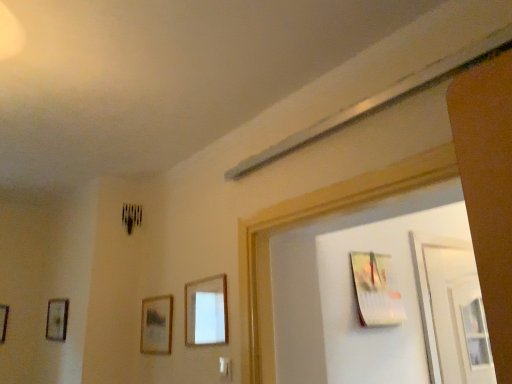
In the scene shown: Measure the distance between wooden picture frame at lower center, arranged as the 3th picture frame when viewed from the right, and camera.

A distance of 2.01 meters exists between wooden picture frame at lower center, arranged as the 3th picture frame when viewed from the right, and camera.

In order to face wooden picture frame at left, which is counted as the fourth picture frame, starting from the right, should I rotate leftwards or rightwards?

You should look left and rotate roughly 24.868 degrees.

Describe the element at coordinates (57, 319) in the screenshot. Image resolution: width=512 pixels, height=384 pixels. I see `wooden picture frame at left, the 2th picture frame positioned from the left` at that location.

The height and width of the screenshot is (384, 512). Find the location of `wooden picture frame at left, the fifth picture frame viewed from the right`. wooden picture frame at left, the fifth picture frame viewed from the right is located at coordinates (3, 321).

Could you tell me if wooden picture frame at center, acting as the 2th picture frame starting from the right, is turned towards metallic silver picture frame at upper right, the 5th picture frame when ordered from left to right?

No, wooden picture frame at center, acting as the 2th picture frame starting from the right, is not oriented towards metallic silver picture frame at upper right, the 5th picture frame when ordered from left to right.

Based on the photo, are wooden picture frame at center, positioned as the fourth picture frame in left-to-right order, and metallic silver picture frame at upper right, the 5th picture frame when ordered from left to right, making contact?

No, wooden picture frame at center, positioned as the fourth picture frame in left-to-right order, is not making contact with metallic silver picture frame at upper right, the 5th picture frame when ordered from left to right.

Which of these two, wooden picture frame at center, acting as the 2th picture frame starting from the right, or metallic silver picture frame at upper right, the 5th picture frame when ordered from left to right, is bigger?

Bigger between the two is metallic silver picture frame at upper right, the 5th picture frame when ordered from left to right.

Who is shorter, wooden picture frame at center, positioned as the fourth picture frame in left-to-right order, or metallic silver picture frame at upper right, the 5th picture frame when ordered from left to right?

With less height is wooden picture frame at center, positioned as the fourth picture frame in left-to-right order.

From the image's perspective, count 3rd picture frames upward from the wooden picture frame at left, which is counted as the fourth picture frame, starting from the right, and point to it. Please provide its 2D coordinates.

[(376, 290)]

Which object is further away from the camera taking this photo, metallic silver picture frame at upper right, the 1th picture frame when ordered from right to left, or wooden picture frame at left, which is counted as the fourth picture frame, starting from the right?

wooden picture frame at left, which is counted as the fourth picture frame, starting from the right, is further from the camera.

Is point (381, 279) closer or farther from the camera than point (53, 314)?

Point (381, 279).

Which of these two, metallic silver picture frame at upper right, the 1th picture frame when ordered from right to left, or wooden picture frame at left, which is counted as the fourth picture frame, starting from the right, is thinner?

With smaller width is wooden picture frame at left, which is counted as the fourth picture frame, starting from the right.

From a real-world perspective, is wooden picture frame at center, positioned as the fourth picture frame in left-to-right order, positioned over wooden picture frame at left, the 2th picture frame positioned from the left, based on gravity?

Actually, wooden picture frame at center, positioned as the fourth picture frame in left-to-right order, is physically below wooden picture frame at left, the 2th picture frame positioned from the left, in the real world.

Between point (217, 338) and point (58, 310), which one is positioned in front?

The point (217, 338) is more forward.

Can you confirm if wooden picture frame at center, positioned as the fourth picture frame in left-to-right order, is shorter than wooden picture frame at left, which is counted as the fourth picture frame, starting from the right?

Incorrect, the height of wooden picture frame at center, positioned as the fourth picture frame in left-to-right order, does not fall short of that of wooden picture frame at left, which is counted as the fourth picture frame, starting from the right.

Find the location of a particular element. the 2nd picture frame counting from the left side of the wooden picture frame at center, acting as the 2th picture frame starting from the right is located at coordinates (57, 319).

Which object is closer to the camera, wooden picture frame at left, which is counted as the fourth picture frame, starting from the right, or wooden picture frame at lower center, arranged as the third picture frame when viewed from the left?

wooden picture frame at lower center, arranged as the third picture frame when viewed from the left, is closer to the camera.

Which is behind, point (56, 310) or point (167, 334)?

The point (56, 310) is farther.

Based on the photo, from a real-world perspective, between wooden picture frame at left, which is counted as the fourth picture frame, starting from the right, and wooden picture frame at lower center, arranged as the 3th picture frame when viewed from the right, who is vertically higher?

In real-world perspective, wooden picture frame at left, which is counted as the fourth picture frame, starting from the right, is above.

Which is more to the left, wooden picture frame at left, the 2th picture frame positioned from the left, or wooden picture frame at lower center, arranged as the 3th picture frame when viewed from the right?

wooden picture frame at left, the 2th picture frame positioned from the left.

From a real-world perspective, is wooden picture frame at lower center, arranged as the third picture frame when viewed from the left, under metallic silver picture frame at upper right, the 5th picture frame when ordered from left to right?

Yes.

Which is more to the left, wooden picture frame at lower center, arranged as the third picture frame when viewed from the left, or metallic silver picture frame at upper right, the 1th picture frame when ordered from right to left?

wooden picture frame at lower center, arranged as the third picture frame when viewed from the left, is more to the left.

Would you say metallic silver picture frame at upper right, the 5th picture frame when ordered from left to right, is part of wooden picture frame at lower center, arranged as the third picture frame when viewed from the left,'s contents?

No, metallic silver picture frame at upper right, the 5th picture frame when ordered from left to right, is not a part of wooden picture frame at lower center, arranged as the third picture frame when viewed from the left.

Are wooden picture frame at lower center, arranged as the third picture frame when viewed from the left, and metallic silver picture frame at upper right, the 5th picture frame when ordered from left to right, located far from each other?

No, wooden picture frame at lower center, arranged as the third picture frame when viewed from the left, is not far from metallic silver picture frame at upper right, the 5th picture frame when ordered from left to right.

From a real-world perspective, who is located higher, wooden picture frame at left, which ranks as the 1th picture frame in left-to-right order, or wooden picture frame at left, which is counted as the fourth picture frame, starting from the right?

From a 3D spatial view, wooden picture frame at left, which is counted as the fourth picture frame, starting from the right, is above.

Looking at this image, would you say wooden picture frame at left, which is counted as the fourth picture frame, starting from the right, is part of wooden picture frame at left, the fifth picture frame viewed from the right,'s contents?

No, wooden picture frame at left, which is counted as the fourth picture frame, starting from the right, is not a part of wooden picture frame at left, the fifth picture frame viewed from the right.

At what (x,y) coordinates should I click in order to perform the action: click on picture frame behind the wooden picture frame at left, which is counted as the fourth picture frame, starting from the right. Please return your answer as a coordinate pair (x, y). This screenshot has width=512, height=384. Looking at the image, I should click on (3, 321).

How different are the orientations of wooden picture frame at left, the fifth picture frame viewed from the right, and wooden picture frame at left, the 2th picture frame positioned from the left, in degrees?

87.3 degrees.

How much distance is there between metallic silver picture frame at upper right, the 5th picture frame when ordered from left to right, and wooden picture frame at lower center, arranged as the third picture frame when viewed from the left?

metallic silver picture frame at upper right, the 5th picture frame when ordered from left to right, and wooden picture frame at lower center, arranged as the third picture frame when viewed from the left, are 38.50 inches apart.

How different are the orientations of metallic silver picture frame at upper right, the 1th picture frame when ordered from right to left, and wooden picture frame at lower center, arranged as the third picture frame when viewed from the left, in degrees?

The facing directions of metallic silver picture frame at upper right, the 1th picture frame when ordered from right to left, and wooden picture frame at lower center, arranged as the third picture frame when viewed from the left, are 90.4 degrees apart.

This screenshot has height=384, width=512. In order to click on the 1st picture frame behind the metallic silver picture frame at upper right, the 1th picture frame when ordered from right to left, starting your count from the anchor in this screenshot , I will do `click(156, 325)`.

From the image's perspective, which is above, metallic silver picture frame at upper right, the 5th picture frame when ordered from left to right, or wooden picture frame at lower center, arranged as the 3th picture frame when viewed from the right?

From the image's view, metallic silver picture frame at upper right, the 5th picture frame when ordered from left to right, is above.

Starting from the metallic silver picture frame at upper right, the 5th picture frame when ordered from left to right, which picture frame is the 1st one to the left? Please provide its 2D coordinates.

[(206, 311)]

The height and width of the screenshot is (384, 512). Find the location of `the 3rd picture frame counting from the right of the wooden picture frame at left, which is counted as the fourth picture frame, starting from the right`. the 3rd picture frame counting from the right of the wooden picture frame at left, which is counted as the fourth picture frame, starting from the right is located at coordinates (376, 290).

Estimate the real-world distances between objects in this image. Which object is further from wooden picture frame at left, the 2th picture frame positioned from the left, wooden picture frame at center, acting as the 2th picture frame starting from the right, or metallic silver picture frame at upper right, the 5th picture frame when ordered from left to right?

Among the two, metallic silver picture frame at upper right, the 5th picture frame when ordered from left to right, is located further to wooden picture frame at left, the 2th picture frame positioned from the left.

Looking at the image, which one is located further to wooden picture frame at center, acting as the 2th picture frame starting from the right, wooden picture frame at left, which is counted as the fourth picture frame, starting from the right, or wooden picture frame at left, which ranks as the 1th picture frame in left-to-right order?

wooden picture frame at left, which ranks as the 1th picture frame in left-to-right order, is further to wooden picture frame at center, acting as the 2th picture frame starting from the right.

From the image, which object appears to be farther from wooden picture frame at left, the 2th picture frame positioned from the left, wooden picture frame at lower center, arranged as the third picture frame when viewed from the left, or metallic silver picture frame at upper right, the 5th picture frame when ordered from left to right?

metallic silver picture frame at upper right, the 5th picture frame when ordered from left to right, is further to wooden picture frame at left, the 2th picture frame positioned from the left.

Based on their spatial positions, is metallic silver picture frame at upper right, the 5th picture frame when ordered from left to right, or wooden picture frame at lower center, arranged as the third picture frame when viewed from the left, closer to wooden picture frame at left, the 2th picture frame positioned from the left?

wooden picture frame at lower center, arranged as the third picture frame when viewed from the left, is positioned closer to the anchor wooden picture frame at left, the 2th picture frame positioned from the left.

Which object lies further to the anchor point wooden picture frame at lower center, arranged as the 3th picture frame when viewed from the right, wooden picture frame at left, which ranks as the 1th picture frame in left-to-right order, or wooden picture frame at center, acting as the 2th picture frame starting from the right?

wooden picture frame at left, which ranks as the 1th picture frame in left-to-right order.

When comparing their distances from wooden picture frame at center, positioned as the fourth picture frame in left-to-right order, does wooden picture frame at lower center, arranged as the third picture frame when viewed from the left, or wooden picture frame at left, the 2th picture frame positioned from the left, seem further?

wooden picture frame at left, the 2th picture frame positioned from the left.

When comparing their distances from wooden picture frame at left, which is counted as the fourth picture frame, starting from the right, does wooden picture frame at left, which ranks as the 1th picture frame in left-to-right order, or wooden picture frame at center, positioned as the fourth picture frame in left-to-right order, seem closer?

Based on the image, wooden picture frame at left, which ranks as the 1th picture frame in left-to-right order, appears to be nearer to wooden picture frame at left, which is counted as the fourth picture frame, starting from the right.

Which object lies nearer to the anchor point wooden picture frame at left, which ranks as the 1th picture frame in left-to-right order, wooden picture frame at lower center, arranged as the 3th picture frame when viewed from the right, or wooden picture frame at center, positioned as the fourth picture frame in left-to-right order?

The object closer to wooden picture frame at left, which ranks as the 1th picture frame in left-to-right order, is wooden picture frame at lower center, arranged as the 3th picture frame when viewed from the right.

Where is `picture frame between wooden picture frame at left, which is counted as the fourth picture frame, starting from the right, and wooden picture frame at center, acting as the 2th picture frame starting from the right, in the horizontal direction`? picture frame between wooden picture frame at left, which is counted as the fourth picture frame, starting from the right, and wooden picture frame at center, acting as the 2th picture frame starting from the right, in the horizontal direction is located at coordinates (156, 325).

This screenshot has height=384, width=512. What are the coordinates of `picture frame situated between wooden picture frame at lower center, arranged as the 3th picture frame when viewed from the right, and metallic silver picture frame at upper right, the 5th picture frame when ordered from left to right, from left to right` in the screenshot? It's located at (206, 311).

I want to click on picture frame between wooden picture frame at left, which ranks as the 1th picture frame in left-to-right order, and wooden picture frame at lower center, arranged as the third picture frame when viewed from the left, in the horizontal direction, so click(57, 319).